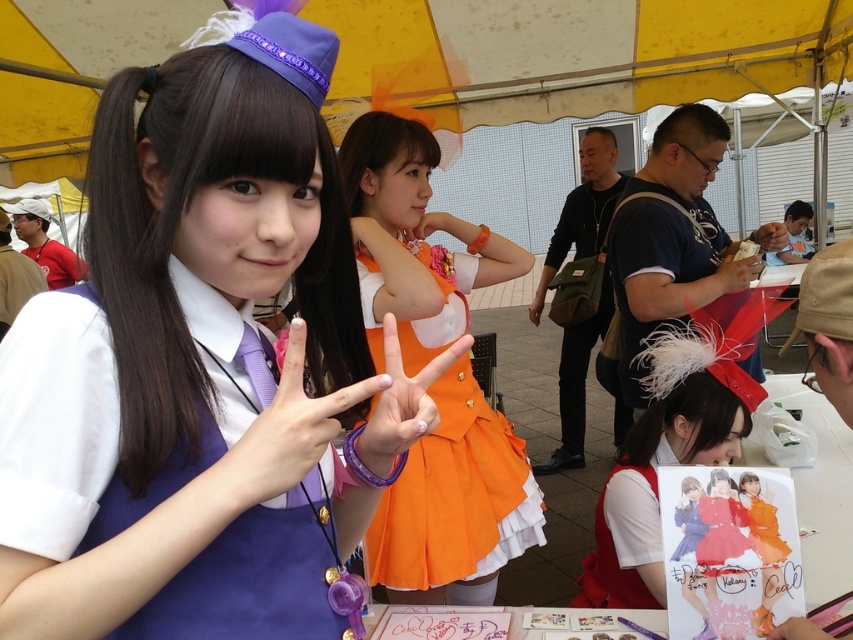
Question: Where is matte purple dress at center located in relation to matte orange hand at center in the image?

Choices:
 (A) left
 (B) right

Answer: (A)

Question: Which is nearer to the orange satin dress at center?

Choices:
 (A) matte orange hand at center
 (B) matte black hand at center
 (C) matte brown hand at center
 (D) purple fabric wristband at center

Answer: (D)

Question: Which point is closer to the camera?

Choices:
 (A) (537, 296)
 (B) (447, 292)

Answer: (B)

Question: In this image, where is matte black hand at center located relative to pink matte pen at center?

Choices:
 (A) left
 (B) right

Answer: (B)

Question: Among these objects, which one is nearest to the camera?

Choices:
 (A) matte orange dress at center
 (B) purple fabric wristband at center
 (C) matte purple dress at center
 (D) orange satin dress at center

Answer: (C)

Question: Is purple fabric wristband at center closer to the viewer compared to matte brown hand at center?

Choices:
 (A) yes
 (B) no

Answer: (A)